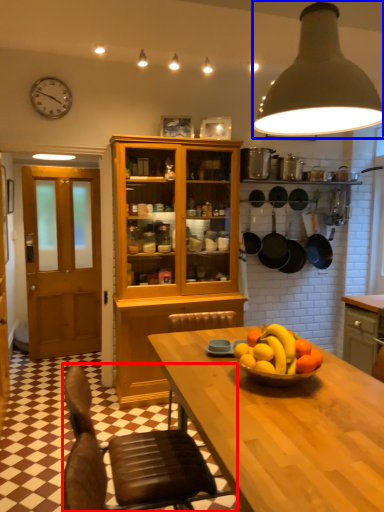
Question: Which point is closer to the camera, chair (highlighted by a red box) or light (highlighted by a blue box)?

Choices:
 (A) chair
 (B) light

Answer: (B)